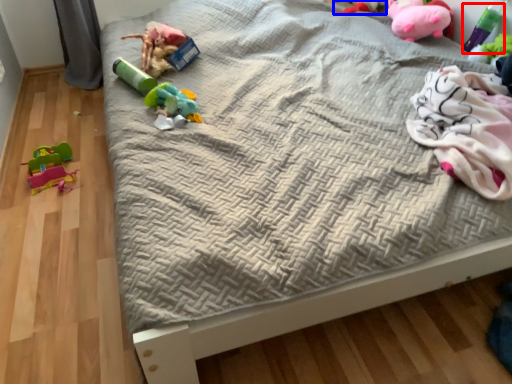
Question: Which object is further to the camera taking this photo, toy (highlighted by a red box) or toy (highlighted by a blue box)?

Choices:
 (A) toy
 (B) toy

Answer: (B)